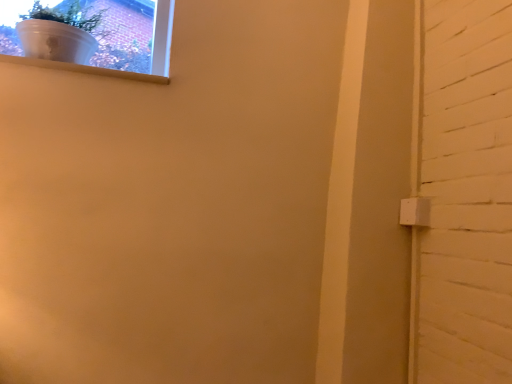
The width and height of the screenshot is (512, 384). What do you see at coordinates (93, 37) in the screenshot? I see `white matte pot at upper left` at bounding box center [93, 37].

What are the coordinates of `white matte pot at upper left` in the screenshot? It's located at (93, 37).

The height and width of the screenshot is (384, 512). I want to click on white matte pot at upper left, so click(93, 37).